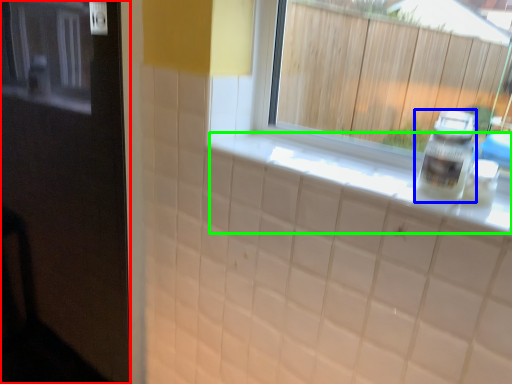
Question: Which object is the farthest from door (highlighted by a red box)? Choose among these: bottle (highlighted by a blue box) or counter top (highlighted by a green box).

Choices:
 (A) bottle
 (B) counter top

Answer: (A)